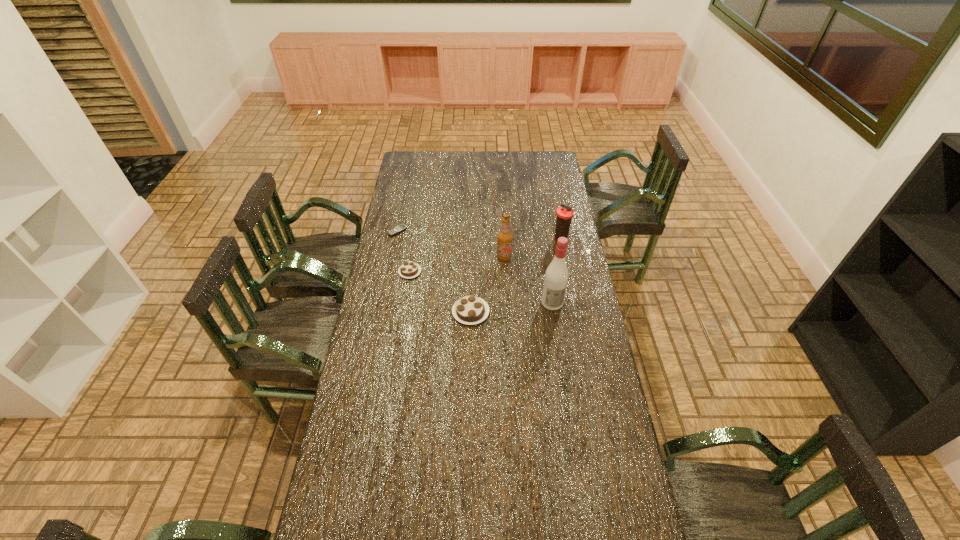
The height and width of the screenshot is (540, 960). I want to click on free space that is in between the beeper and the shorter chocolate cake, so click(x=404, y=252).

Locate an element on the screen. This screenshot has width=960, height=540. vacant region between the fifth object from left to right and the farther chocolate cake is located at coordinates (481, 287).

The height and width of the screenshot is (540, 960). In order to click on vacant region between the fourth object from left to right and the beeper in this screenshot , I will do `click(451, 245)`.

Locate an element on the screen. free space between the beeper and the thermos bottle is located at coordinates (479, 235).

Locate an element on the screen. The image size is (960, 540). free space between the right chocolate cake and the beer bottle is located at coordinates (488, 285).

Identify the location of empty space between the third object from right to left and the rightmost object. (533, 248).

Find the location of a particular element. The image size is (960, 540). object that is the closest to the fourth farthest object is located at coordinates (470, 310).

Identify the location of object that is the fourth nearest to the second shortest object. This screenshot has width=960, height=540. (556, 276).

Locate an element on the screen. free space that satisfies the following two spatial constraints: 1. on the front side of the beeper; 2. on the left side of the rightmost object is located at coordinates (396, 239).